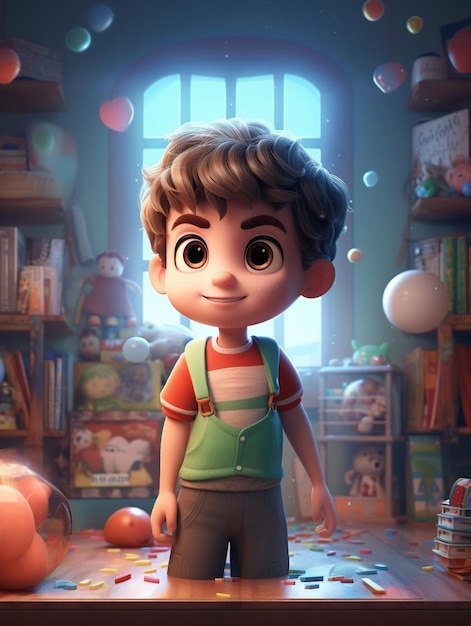
The image size is (471, 626). I want to click on wall, so click(394, 130).